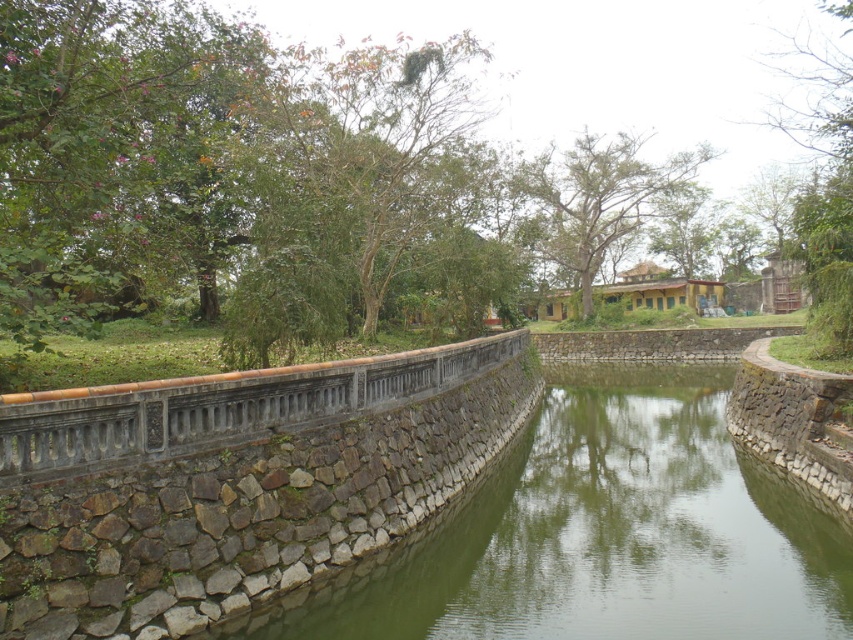
Question: Is green leafy tree at upper left to the left of green leafy tree at center from the viewer's perspective?

Choices:
 (A) yes
 (B) no

Answer: (A)

Question: Which point appears farthest from the camera in this image?

Choices:
 (A) (822, 132)
 (B) (4, 445)

Answer: (A)

Question: Does green leafy tree at upper center have a greater width compared to green leafy tree at center?

Choices:
 (A) no
 (B) yes

Answer: (B)

Question: Which object is farther from the camera taking this photo?

Choices:
 (A) green leafy tree at upper right
 (B) green leafy tree at upper left
 (C) green leafy tree at center

Answer: (C)

Question: Which object is positioned closest to the green leafy tree at upper left?

Choices:
 (A) brown stone bridge at center
 (B) green leafy tree at upper right

Answer: (A)

Question: Can you confirm if green leafy tree at upper left is positioned to the right of green leafy tree at center?

Choices:
 (A) no
 (B) yes

Answer: (A)